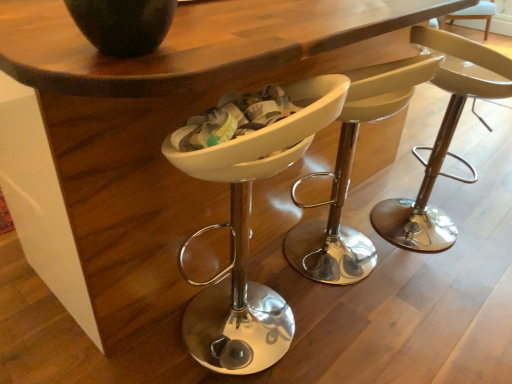
Locate an element on the screen. matte beige stool at center, the third chair when ordered from left to right is located at coordinates (440, 145).

Measure the distance between point (450, 232) and camera.

A distance of 1.86 meters exists between point (450, 232) and camera.

Measure the distance between white plastic chair at center, the 2th chair when ordered from right to left, and camera.

white plastic chair at center, the 2th chair when ordered from right to left, and camera are 1.62 meters apart from each other.

Find the location of a particular element. matte black vase at upper left is located at coordinates (123, 24).

Measure the distance between matte black vase at upper left and camera.

matte black vase at upper left and camera are 28.70 inches apart.

What is the approximate height of white plastic chair at center, which ranks as the 3th chair in right-to-left order?

It is 35.51 inches.

The height and width of the screenshot is (384, 512). Describe the element at coordinates (473, 15) in the screenshot. I see `matte white bar stool at center` at that location.

The image size is (512, 384). Find the location of `matte beige stool at center, which ranks as the first chair in right-to-left order`. matte beige stool at center, which ranks as the first chair in right-to-left order is located at coordinates (440, 145).

Which of these two, matte white bar stool at center or white plastic chair at center, which appears as the first chair when viewed from the left, is bigger?

white plastic chair at center, which appears as the first chair when viewed from the left, is bigger.

Based on the photo, is matte white bar stool at center touching white plastic chair at center, which ranks as the 3th chair in right-to-left order?

matte white bar stool at center and white plastic chair at center, which ranks as the 3th chair in right-to-left order, are not in contact.

Would you say matte white bar stool at center is outside white plastic chair at center, which ranks as the 3th chair in right-to-left order?

matte white bar stool at center is positioned outside white plastic chair at center, which ranks as the 3th chair in right-to-left order.

Can you tell me how much matte white bar stool at center and white plastic chair at center, which ranks as the 3th chair in right-to-left order, differ in facing direction?

The angle between the facing direction of matte white bar stool at center and the facing direction of white plastic chair at center, which ranks as the 3th chair in right-to-left order, is 89.7 degrees.

From the image's perspective, between matte beige stool at center, which ranks as the first chair in right-to-left order, and white plastic chair at center, which is counted as the 2th chair, starting from the left, which one is located above?

matte beige stool at center, which ranks as the first chair in right-to-left order, appears higher in the image.

Is white plastic chair at center, the 2th chair when ordered from right to left, a part of matte beige stool at center, the third chair when ordered from left to right?

No, white plastic chair at center, the 2th chair when ordered from right to left, is not inside matte beige stool at center, the third chair when ordered from left to right.

Based on the photo, considering the positions of objects matte beige stool at center, which ranks as the first chair in right-to-left order, and white plastic chair at center, which is counted as the 2th chair, starting from the left, in the image provided, who is more to the right, matte beige stool at center, which ranks as the first chair in right-to-left order, or white plastic chair at center, which is counted as the 2th chair, starting from the left,?

matte beige stool at center, which ranks as the first chair in right-to-left order.

Which of these two, matte beige stool at center, which ranks as the first chair in right-to-left order, or white plastic chair at center, which is counted as the 2th chair, starting from the left, is thinner?

With smaller width is matte beige stool at center, which ranks as the first chair in right-to-left order.

Which object is closer to the camera, matte black vase at upper left or matte beige stool at center, which ranks as the first chair in right-to-left order?

matte black vase at upper left.

In the image, is matte black vase at upper left on the left side or the right side of matte beige stool at center, the third chair when ordered from left to right?

From the image, it's evident that matte black vase at upper left is to the left of matte beige stool at center, the third chair when ordered from left to right.

Is matte black vase at upper left oriented towards matte beige stool at center, the third chair when ordered from left to right?

No.

Which of these two, matte black vase at upper left or matte beige stool at center, the third chair when ordered from left to right, is bigger?

matte beige stool at center, the third chair when ordered from left to right.

From the image's perspective, which is below, white plastic chair at center, which appears as the first chair when viewed from the left, or white plastic chair at center, which is counted as the 2th chair, starting from the left?

white plastic chair at center, which appears as the first chair when viewed from the left, appears lower in the image.

Locate an element on the screen. The width and height of the screenshot is (512, 384). the 1st chair to the right of the white plastic chair at center, which appears as the first chair when viewed from the left, counting from the anchor's position is located at coordinates (350, 173).

Is white plastic chair at center, which ranks as the 3th chair in right-to-left order, inside or outside of white plastic chair at center, the 2th chair when ordered from right to left?

The correct answer is: outside.

Can you see white plastic chair at center, which ranks as the 3th chair in right-to-left order, touching white plastic chair at center, the 2th chair when ordered from right to left?

white plastic chair at center, which ranks as the 3th chair in right-to-left order, and white plastic chair at center, the 2th chair when ordered from right to left, are clearly separated.

Who is bigger, white plastic chair at center, which is counted as the 2th chair, starting from the left, or white plastic chair at center, which appears as the first chair when viewed from the left?

white plastic chair at center, which is counted as the 2th chair, starting from the left.

From the white plastic chair at center, which appears as the first chair when viewed from the left, count 1st chair to the right and point to it. Please provide its 2D coordinates.

[(350, 173)]

Considering the relative positions of white plastic chair at center, the 2th chair when ordered from right to left, and white plastic chair at center, which ranks as the 3th chair in right-to-left order, in the image provided, is white plastic chair at center, the 2th chair when ordered from right to left, to the left or to the right of white plastic chair at center, which ranks as the 3th chair in right-to-left order,?

From the image, it's evident that white plastic chair at center, the 2th chair when ordered from right to left, is to the right of white plastic chair at center, which ranks as the 3th chair in right-to-left order.

Based on the photo, what's the angular difference between white plastic chair at center, which is counted as the 2th chair, starting from the left, and white plastic chair at center, which ranks as the 3th chair in right-to-left order,'s facing directions?

They differ by 0.000699 degrees in their facing directions.

Which of these two, matte beige stool at center, the third chair when ordered from left to right, or white plastic chair at center, which appears as the first chair when viewed from the left, is thinner?

matte beige stool at center, the third chair when ordered from left to right.

At what (x,y) coordinates should I click in order to perform the action: click on chair directly beneath the matte beige stool at center, which ranks as the first chair in right-to-left order (from a real-world perspective). Please return your answer as a coordinate pair (x, y). Looking at the image, I should click on (250, 234).

Is matte beige stool at center, which ranks as the first chair in right-to-left order, taller than white plastic chair at center, which ranks as the 3th chair in right-to-left order?

Incorrect, the height of matte beige stool at center, which ranks as the first chair in right-to-left order, is not larger of that of white plastic chair at center, which ranks as the 3th chair in right-to-left order.

Considering the sizes of objects matte beige stool at center, the third chair when ordered from left to right, and white plastic chair at center, which appears as the first chair when viewed from the left, in the image provided, who is smaller, matte beige stool at center, the third chair when ordered from left to right, or white plastic chair at center, which appears as the first chair when viewed from the left,?

matte beige stool at center, the third chair when ordered from left to right, is smaller.

From the picture: How distant is white plastic chair at center, which is counted as the 2th chair, starting from the left, from matte beige stool at center, the third chair when ordered from left to right?

They are 11.64 inches apart.

Are white plastic chair at center, which is counted as the 2th chair, starting from the left, and matte beige stool at center, which ranks as the first chair in right-to-left order, beside each other?

No, white plastic chair at center, which is counted as the 2th chair, starting from the left, is not touching matte beige stool at center, which ranks as the first chair in right-to-left order.

Which object is thinner, white plastic chair at center, which is counted as the 2th chair, starting from the left, or matte beige stool at center, the third chair when ordered from left to right?

With smaller width is matte beige stool at center, the third chair when ordered from left to right.

From a real-world perspective, is white plastic chair at center, the 2th chair when ordered from right to left, physically located above or below matte beige stool at center, which ranks as the first chair in right-to-left order?

white plastic chair at center, the 2th chair when ordered from right to left, is situated higher than matte beige stool at center, which ranks as the first chair in right-to-left order, in the real world.

Find the location of a particular element. This screenshot has height=384, width=512. the 3rd chair positioned below the matte white bar stool at center (from the image's perspective) is located at coordinates (250, 234).

I want to click on chair on the right side of white plastic chair at center, the 2th chair when ordered from right to left, so click(x=440, y=145).

When comparing their distances from matte white bar stool at center, does white plastic chair at center, which ranks as the 3th chair in right-to-left order, or white plastic chair at center, the 2th chair when ordered from right to left, seem further?

Among the two, white plastic chair at center, which ranks as the 3th chair in right-to-left order, is located further to matte white bar stool at center.

Considering their positions, is white plastic chair at center, which ranks as the 3th chair in right-to-left order, positioned further to matte black vase at upper left than matte white bar stool at center?

matte white bar stool at center is positioned further to the anchor matte black vase at upper left.

Looking at the image, which one is located closer to white plastic chair at center, the 2th chair when ordered from right to left, matte beige stool at center, which ranks as the first chair in right-to-left order, or matte black vase at upper left?

Among the two, matte beige stool at center, which ranks as the first chair in right-to-left order, is located nearer to white plastic chair at center, the 2th chair when ordered from right to left.

Estimate the real-world distances between objects in this image. Which object is closer to matte black vase at upper left, white plastic chair at center, the 2th chair when ordered from right to left, or white plastic chair at center, which ranks as the 3th chair in right-to-left order?

Among the two, white plastic chair at center, which ranks as the 3th chair in right-to-left order, is located nearer to matte black vase at upper left.

Which object lies further to the anchor point matte black vase at upper left, matte white bar stool at center or white plastic chair at center, which appears as the first chair when viewed from the left?

matte white bar stool at center.

Estimate the real-world distances between objects in this image. Which object is further from matte beige stool at center, the third chair when ordered from left to right, matte black vase at upper left or white plastic chair at center, the 2th chair when ordered from right to left?

Among the two, matte black vase at upper left is located further to matte beige stool at center, the third chair when ordered from left to right.

Which object lies further to the anchor point white plastic chair at center, which appears as the first chair when viewed from the left, matte black vase at upper left or white plastic chair at center, which is counted as the 2th chair, starting from the left?

matte black vase at upper left.

Consider the image. Which object lies further to the anchor point matte white bar stool at center, matte beige stool at center, which ranks as the first chair in right-to-left order, or white plastic chair at center, which ranks as the 3th chair in right-to-left order?

Among the two, white plastic chair at center, which ranks as the 3th chair in right-to-left order, is located further to matte white bar stool at center.

This screenshot has height=384, width=512. Find the location of `chair situated between white plastic chair at center, which ranks as the 3th chair in right-to-left order, and matte beige stool at center, the third chair when ordered from left to right, from left to right`. chair situated between white plastic chair at center, which ranks as the 3th chair in right-to-left order, and matte beige stool at center, the third chair when ordered from left to right, from left to right is located at coordinates (350, 173).

Image resolution: width=512 pixels, height=384 pixels. In order to click on chair situated between matte black vase at upper left and white plastic chair at center, which is counted as the 2th chair, starting from the left, from left to right in this screenshot , I will do `click(250, 234)`.

This screenshot has width=512, height=384. I want to click on chair between white plastic chair at center, the 2th chair when ordered from right to left, and matte white bar stool at center from front to back, so click(x=440, y=145).